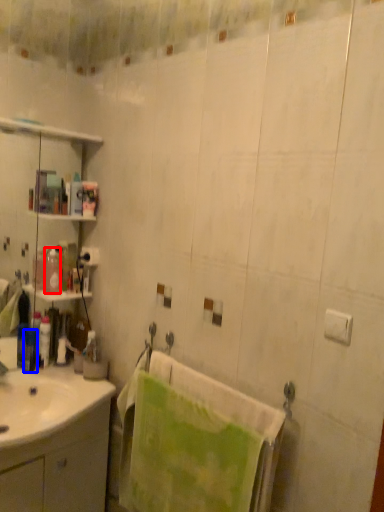
Question: Which object appears closest to the camera in this image, toiletry (highlighted by a red box) or toiletry (highlighted by a blue box)?

Choices:
 (A) toiletry
 (B) toiletry

Answer: (A)